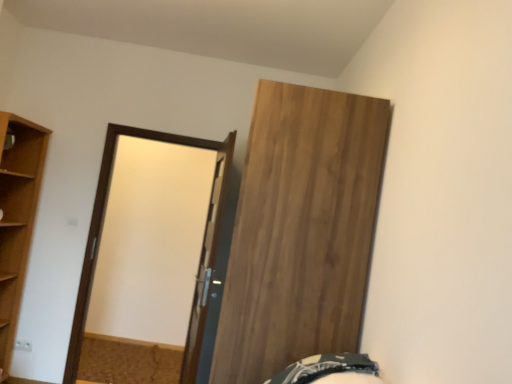
Question: In terms of width, does dark green fabric bed at lower right look wider or thinner when compared to wooden door at upper right, the 1th door when ordered from right to left?

Choices:
 (A) thin
 (B) wide

Answer: (A)

Question: Based on their positions, is dark green fabric bed at lower right located to the left or right of wooden door at upper right, marked as the second door in a left-to-right arrangement?

Choices:
 (A) right
 (B) left

Answer: (A)

Question: Which is nearer to the matte brown door at center?

Choices:
 (A) dark green fabric bed at lower right
 (B) wooden door at upper right, the 1th door when ordered from right to left
 (C) light brown wood at left
 (D) white glossy door at center, which is the second door in right-to-left order

Answer: (D)

Question: Estimate the real-world distances between objects in this image. Which object is farther from the white glossy door at center, which is the second door in right-to-left order?

Choices:
 (A) matte brown door at center
 (B) light brown wood at left
 (C) wooden door at upper right, the 1th door when ordered from right to left
 (D) dark green fabric bed at lower right

Answer: (B)